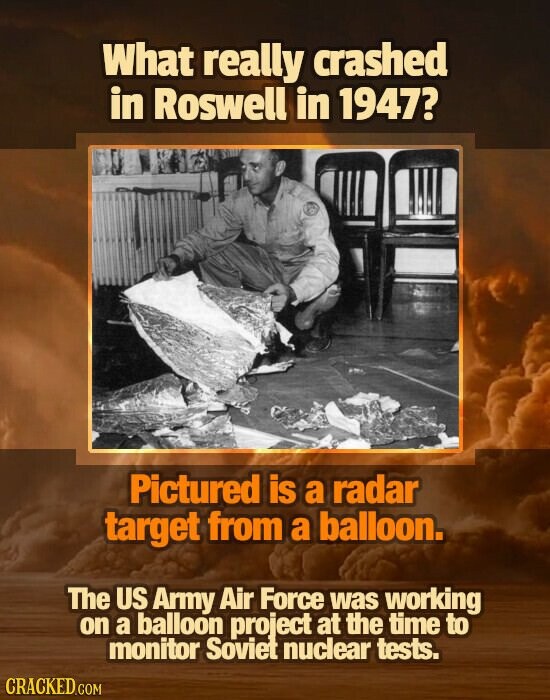
You are a GUI agent. You are given a task and a screenshot of the screen. Output one action in this format:
    pyautogui.click(x=<x>, y=<y>)
    Task: Click on the places to sit
    
    Given the screenshot: What is the action you would take?
    pyautogui.click(x=350, y=225), pyautogui.click(x=418, y=230)